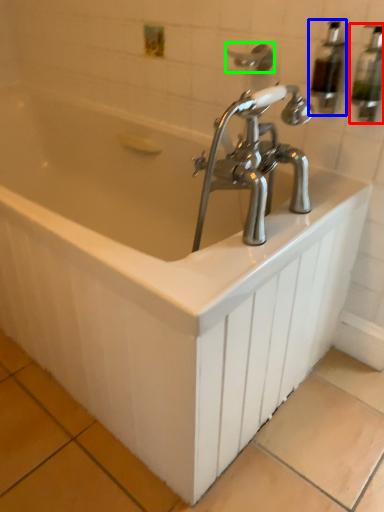
Question: Which is nearer to the soap dispenser (highlighted by a red box)? soap dispenser (highlighted by a blue box) or shower (highlighted by a green box).

Choices:
 (A) soap dispenser
 (B) shower

Answer: (A)